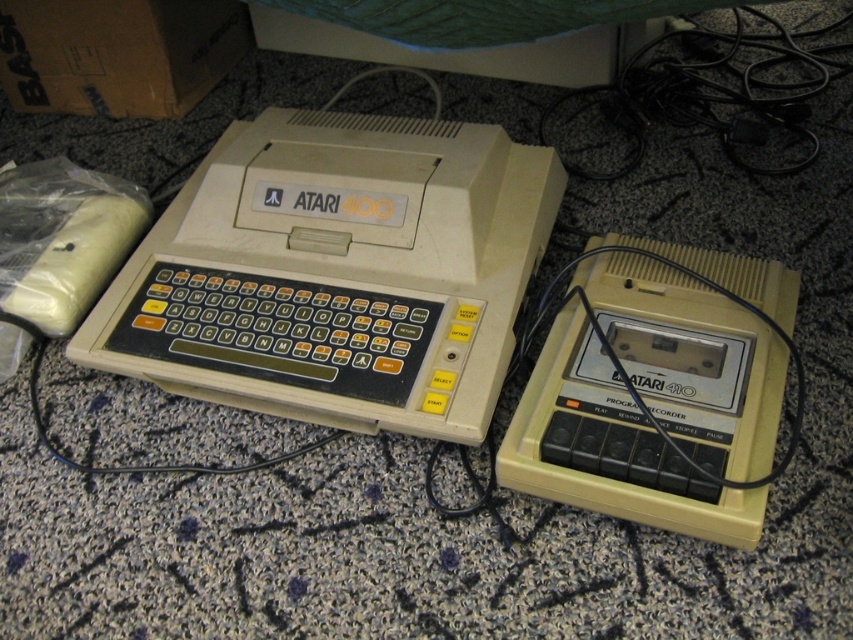
Question: Which of the following is the closest to the observer?

Choices:
 (A) 486,344
 (B) 544,460

Answer: (B)

Question: Can you confirm if beige plastic atari 400 at center is positioned to the right of beige plastic atari 410 at right?

Choices:
 (A) yes
 (B) no

Answer: (B)

Question: Is beige plastic atari 400 at center to the left of beige plastic atari 410 at right from the viewer's perspective?

Choices:
 (A) yes
 (B) no

Answer: (A)

Question: Does beige plastic atari 400 at center come behind beige plastic atari 410 at right?

Choices:
 (A) no
 (B) yes

Answer: (B)